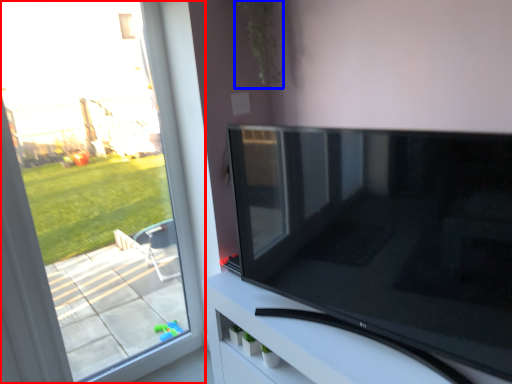
Question: Among these objects, which one is nearest to the camera, window (highlighted by a red box) or plant (highlighted by a blue box)?

Choices:
 (A) window
 (B) plant

Answer: (A)